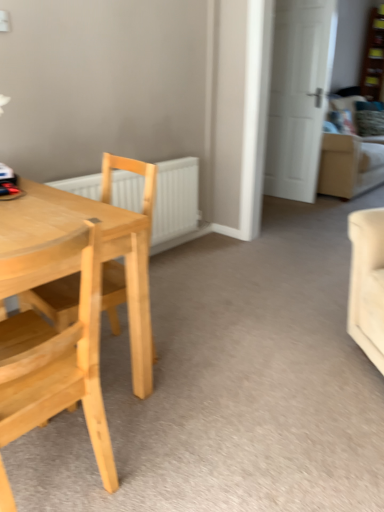
Question: Does wooden bookshelf at upper right lie behind light wood chair at left, the second chair viewed from the back?

Choices:
 (A) no
 (B) yes

Answer: (B)

Question: Can you confirm if wooden bookshelf at upper right is smaller than light wood chair at left, the second chair viewed from the back?

Choices:
 (A) yes
 (B) no

Answer: (A)

Question: Does wooden bookshelf at upper right have a lesser width compared to light wood chair at left, the 1th chair from the front?

Choices:
 (A) no
 (B) yes

Answer: (B)

Question: From the image's perspective, is wooden bookshelf at upper right below light wood chair at left, the second chair viewed from the back?

Choices:
 (A) yes
 (B) no

Answer: (B)

Question: Considering the relative sizes of wooden bookshelf at upper right and light wood chair at left, the second chair viewed from the back, in the image provided, is wooden bookshelf at upper right shorter than light wood chair at left, the second chair viewed from the back,?

Choices:
 (A) no
 (B) yes

Answer: (A)

Question: Relative to white matte radiator at center, is white matte door at upper right in front or behind?

Choices:
 (A) behind
 (B) front

Answer: (A)

Question: Looking at the image, does white matte door at upper right seem bigger or smaller compared to white matte radiator at center?

Choices:
 (A) big
 (B) small

Answer: (A)

Question: From the image's perspective, is white matte door at upper right located above or below white matte radiator at center?

Choices:
 (A) above
 (B) below

Answer: (A)

Question: Considering the positions of point (294, 64) and point (170, 239), is point (294, 64) closer or farther from the camera than point (170, 239)?

Choices:
 (A) closer
 (B) farther

Answer: (B)

Question: In terms of height, does white matte door at upper right look taller or shorter compared to natural wood chair at left, which is the second chair in front-to-back order?

Choices:
 (A) tall
 (B) short

Answer: (A)

Question: In terms of width, does white matte door at upper right look wider or thinner when compared to natural wood chair at left, positioned as the 1th chair in back-to-front order?

Choices:
 (A) thin
 (B) wide

Answer: (A)

Question: Relative to natural wood chair at left, which is the second chair in front-to-back order, is white matte door at upper right in front or behind?

Choices:
 (A) behind
 (B) front

Answer: (A)

Question: Does point (284, 65) appear closer or farther from the camera than point (66, 289)?

Choices:
 (A) farther
 (B) closer

Answer: (A)

Question: Based on their sizes in the image, would you say natural wood chair at left, positioned as the 1th chair in back-to-front order, is bigger or smaller than wooden bookshelf at upper right?

Choices:
 (A) big
 (B) small

Answer: (A)

Question: In terms of height, does natural wood chair at left, positioned as the 1th chair in back-to-front order, look taller or shorter compared to wooden bookshelf at upper right?

Choices:
 (A) tall
 (B) short

Answer: (B)